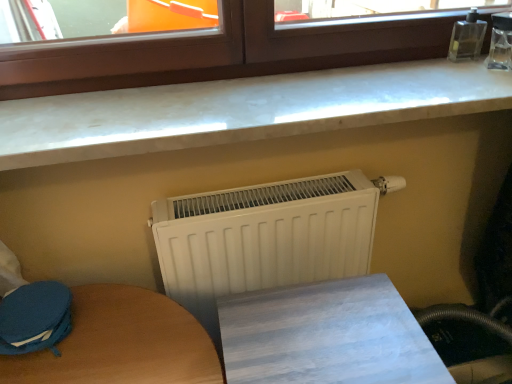
The height and width of the screenshot is (384, 512). I want to click on vacant space situated above blue fabric swivel chair at lower left (from a real-world perspective), so click(30, 303).